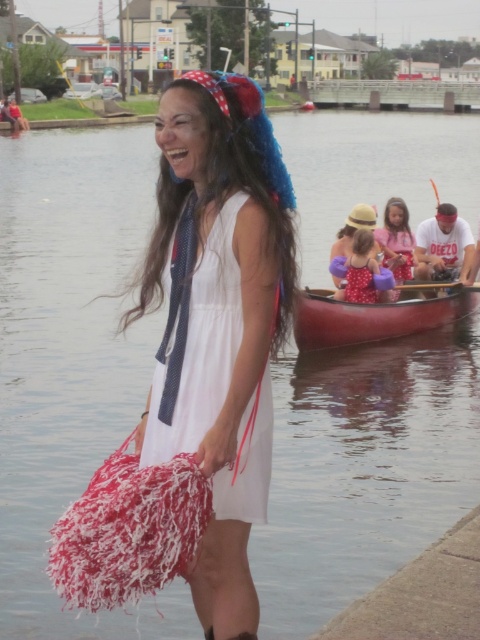
Question: Is white fabric dress at center wider than smooth wood canoe at center?

Choices:
 (A) yes
 (B) no

Answer: (B)

Question: Can you confirm if white fabric dress at center is positioned to the right of matte pink swimsuit at center?

Choices:
 (A) yes
 (B) no

Answer: (B)

Question: Considering the real-world distances, which object is closest to the matte pink swimsuit at center?

Choices:
 (A) white fabric dress at center
 (B) polka dot dress at center
 (C) red and white fabric headdress at upper center

Answer: (B)

Question: Which object appears closest to the camera in this image?

Choices:
 (A) red and white fabric headdress at upper center
 (B) polka dot dress at center
 (C) white fabric dress at center
 (D) smooth wood canoe at center

Answer: (C)

Question: Does white cotton dress at center appear over polka dot fabric dress at center?

Choices:
 (A) yes
 (B) no

Answer: (B)

Question: Which object is the closest to the white cotton dress at center?

Choices:
 (A) white fabric dress at center
 (B) polka dot fabric dress at center
 (C) matte pink swimsuit at center

Answer: (A)